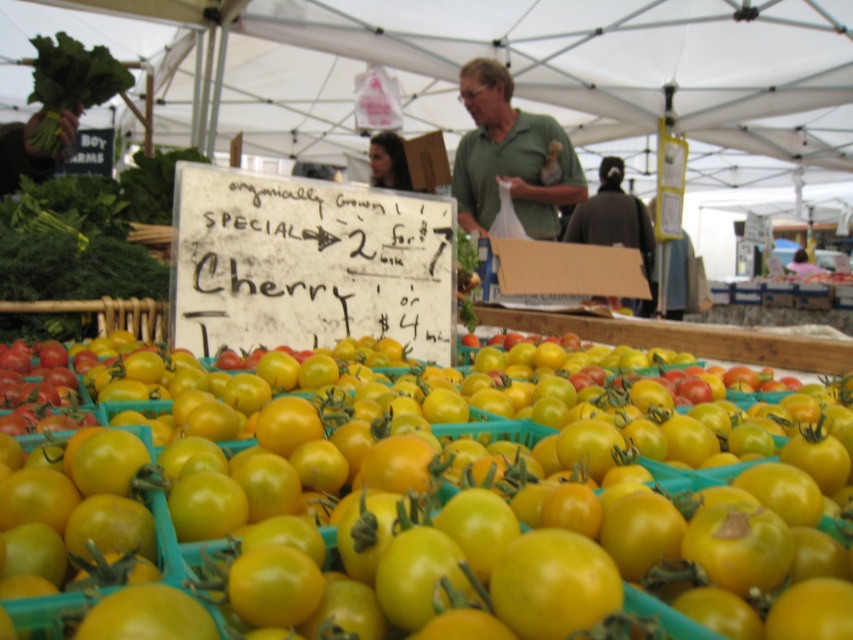
Looking at this image, you are a customer at the farmer market and want to buy the shiny yellow tomato at center. There is a green leafy at upper left nearby. Which item is more to the right?

The shiny yellow tomato at center is positioned on the right side of green leafy at upper left, so it is more to the right.

What are the coordinates of the green matte shirt at center in the image?

The green matte shirt at center is located at coordinates point (509, 156).

You are a customer at the farmer market and want to buy the cherry tomatoes. You see the green matte shirt at center and the green leafy at upper left. Which one is wider?

The green matte shirt at center is wider than the green leafy at upper left.